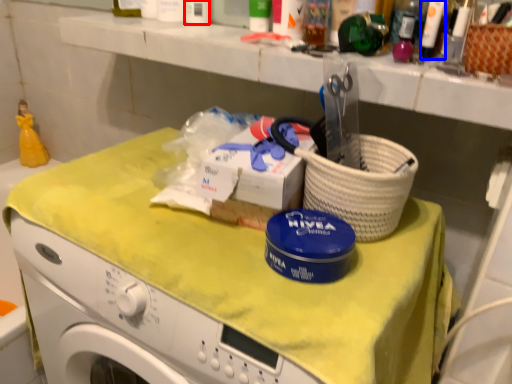
Question: Among these objects, which one is farthest to the camera, toiletry (highlighted by a red box) or toiletry (highlighted by a blue box)?

Choices:
 (A) toiletry
 (B) toiletry

Answer: (A)